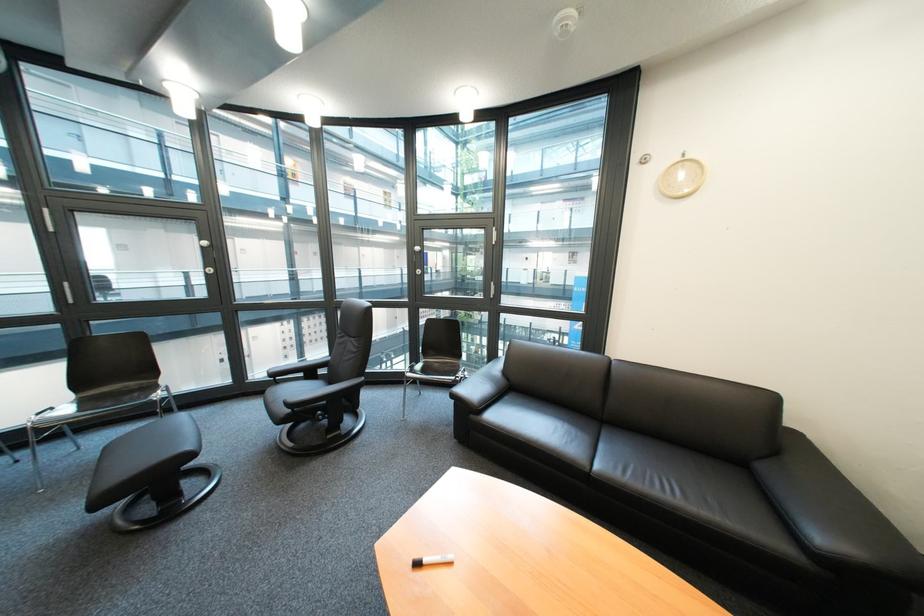
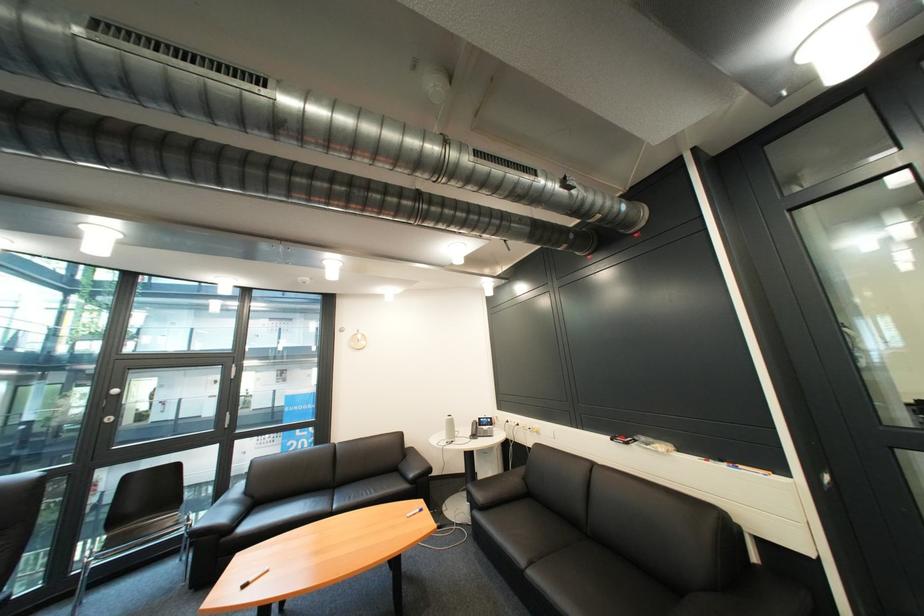
Find the pixel in the second image that matches pixel 774 469 in the first image.

(414, 468)